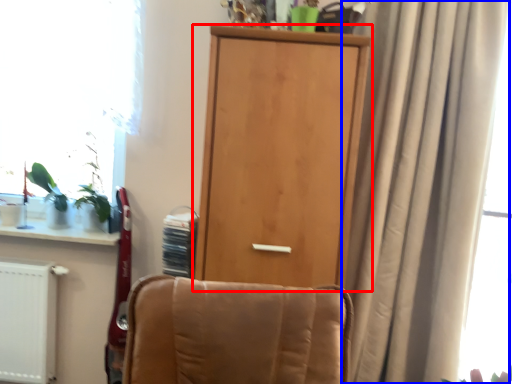
Question: Among these objects, which one is nearest to the camera, door (highlighted by a red box) or curtain (highlighted by a blue box)?

Choices:
 (A) door
 (B) curtain

Answer: (B)